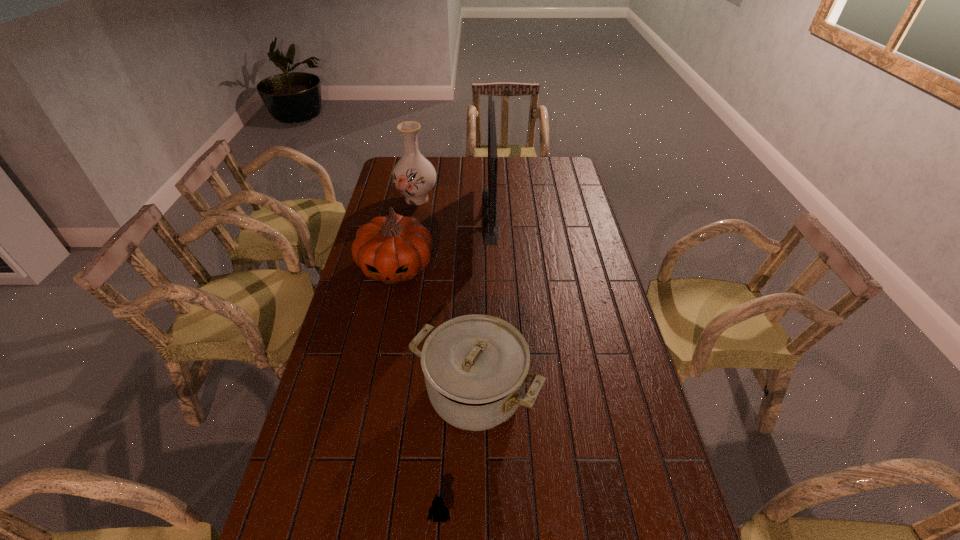
Locate an element on the screen. The width and height of the screenshot is (960, 540). monitor is located at coordinates (489, 196).

At what (x,y) coordinates should I click in order to perform the action: click on the fourth shortest object. Please return your answer as a coordinate pair (x, y). The image size is (960, 540). Looking at the image, I should click on (414, 176).

Image resolution: width=960 pixels, height=540 pixels. In order to click on pumpkin in this screenshot , I will do `click(391, 249)`.

You are a GUI agent. You are given a task and a screenshot of the screen. Output one action in this format:
    pyautogui.click(x=<x>, y=<y>)
    Task: Click on the fourth farthest object
    The height and width of the screenshot is (540, 960).
    Given the screenshot: What is the action you would take?
    pyautogui.click(x=476, y=367)

You are a GUI agent. You are given a task and a screenshot of the screen. Output one action in this format:
    pyautogui.click(x=<x>, y=<y>)
    Task: Click on the fourth tallest object
    This screenshot has height=540, width=960.
    Given the screenshot: What is the action you would take?
    pyautogui.click(x=476, y=367)

I want to click on the shortest object, so click(438, 510).

Locate an element on the screen. This screenshot has width=960, height=540. the nearest object is located at coordinates [438, 510].

The width and height of the screenshot is (960, 540). I want to click on vacant space located 0.150m on the front-facing side of the monitor, so click(447, 214).

Locate an element on the screen. vacant position located 0.400m on the front-facing side of the monitor is located at coordinates (390, 214).

Identify the location of vacant space located 0.230m on the front-facing side of the monitor. The height and width of the screenshot is (540, 960). click(429, 214).